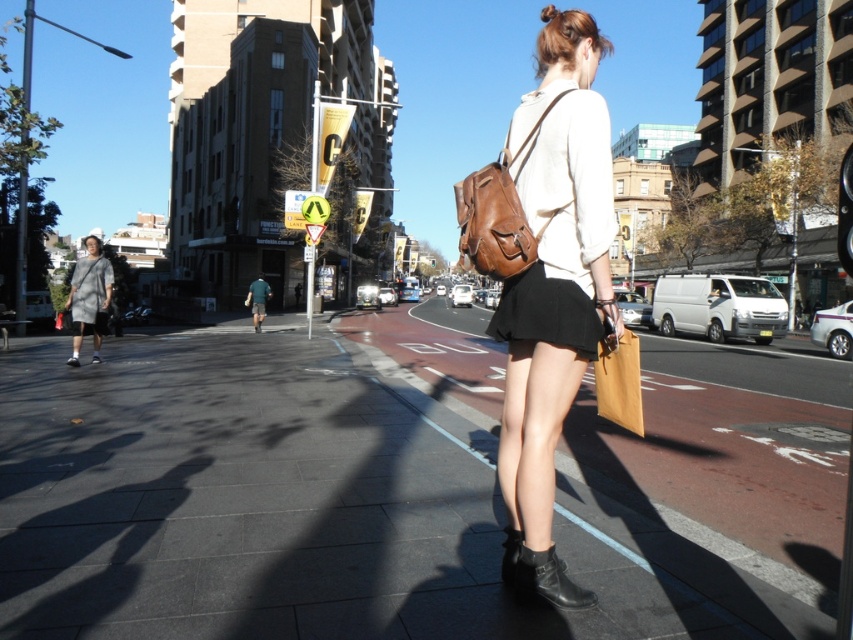
Question: Which point is closer to the camera taking this photo?

Choices:
 (A) (520, 122)
 (B) (344, 532)
 (C) (515, 168)
 (D) (537, 568)

Answer: (D)

Question: Which point is farther to the camera?

Choices:
 (A) (171, 467)
 (B) (556, 12)
 (C) (527, 369)
 (D) (538, 124)

Answer: (A)

Question: Is black leather boot at lower center above blonde hair at upper center?

Choices:
 (A) no
 (B) yes

Answer: (A)

Question: Estimate the real-world distances between objects in this image. Which object is closer to the brown leather backpack at upper center?

Choices:
 (A) black leather boot at center
 (B) black matte skirt at center
 (C) matte brown backpack at center

Answer: (C)

Question: Is black matte skirt at center further to camera compared to brown leather backpack at upper center?

Choices:
 (A) no
 (B) yes

Answer: (A)

Question: Is black matte skirt at center below brown leather backpack at upper center?

Choices:
 (A) yes
 (B) no

Answer: (A)